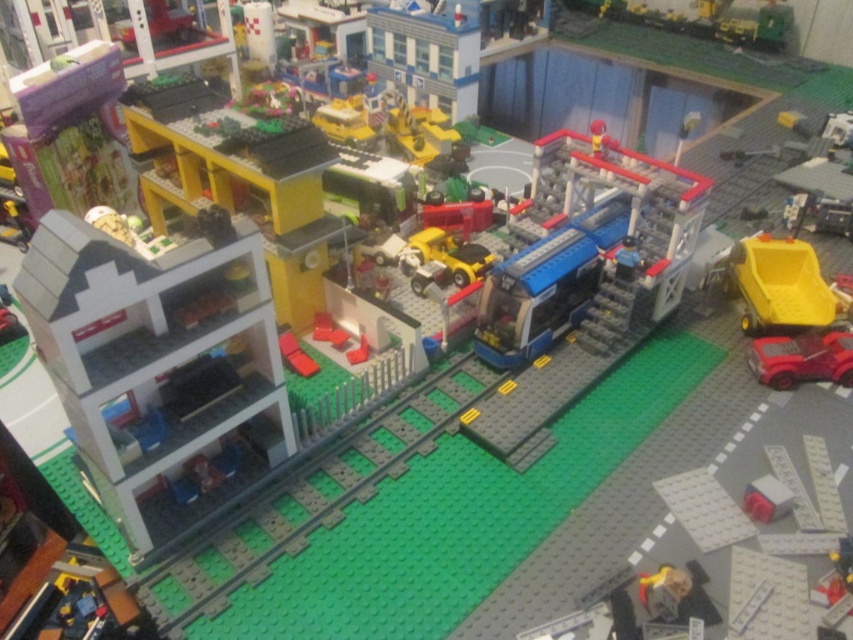
Question: Which of the following is the closest to the observer?

Choices:
 (A) pyautogui.click(x=494, y=285)
 (B) pyautogui.click(x=822, y=362)

Answer: (A)

Question: Is blue plastic bus at center to the right of shiny red car at lower right from the viewer's perspective?

Choices:
 (A) no
 (B) yes

Answer: (A)

Question: Which point appears closest to the camera in this image?

Choices:
 (A) (775, 342)
 (B) (671, 246)

Answer: (A)

Question: From the image, what is the correct spatial relationship of blue plastic bus at center in relation to shiny red car at lower right?

Choices:
 (A) left
 (B) right

Answer: (A)

Question: Is blue plastic bus at center behind shiny red car at lower right?

Choices:
 (A) yes
 (B) no

Answer: (B)